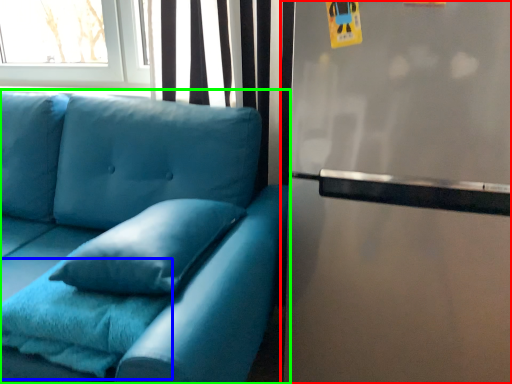
Question: Which object is the closest to the fridge (highlighted by a red box)? Choose among these: blanket (highlighted by a blue box) or studio couch (highlighted by a green box).

Choices:
 (A) blanket
 (B) studio couch

Answer: (B)